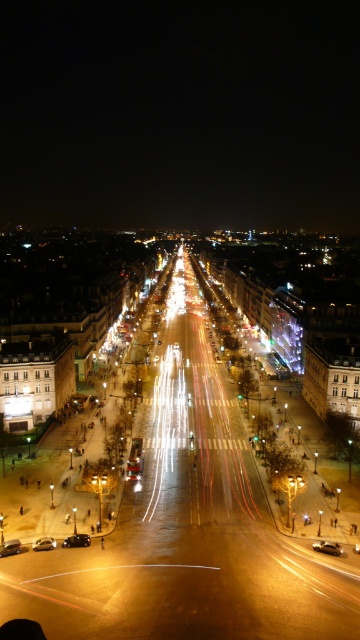
Question: In this image, where is shiny black car at lower left located relative to shiny silver car at center?

Choices:
 (A) right
 (B) left

Answer: (B)

Question: Which of the following is the farthest from the observer?

Choices:
 (A) shiny black car at center
 (B) shiny metallic car at center

Answer: (A)

Question: Does shiny black car at lower left appear on the right side of shiny silver car at center?

Choices:
 (A) no
 (B) yes

Answer: (A)

Question: Based on their relative distances, which object is nearer to the shiny metallic car at center?

Choices:
 (A) shiny black car at lower left
 (B) shiny black car at center

Answer: (B)

Question: Can you confirm if shiny black car at center is bigger than shiny silver car at center?

Choices:
 (A) no
 (B) yes

Answer: (B)

Question: Considering the real-world distances, which object is closest to the shiny black car at center?

Choices:
 (A) shiny metallic car at center
 (B) shiny silver car at center

Answer: (B)